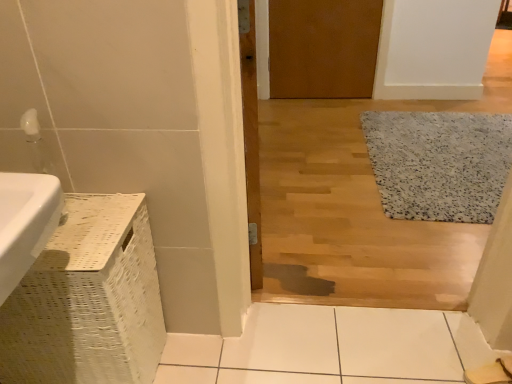
Question: Which direction should I rotate to face brown matte door at upper center, marked as the second door in a left-to-right arrangement, — up or down?

Choices:
 (A) up
 (B) down

Answer: (A)

Question: Does brown matte door at upper center, which ranks as the second door in front-to-back order, come in front of wooden door at center, which is the 1th door in bottom-to-top order?

Choices:
 (A) yes
 (B) no

Answer: (B)

Question: Does brown matte door at upper center, which ranks as the second door in front-to-back order, come behind wooden door at center, acting as the first door starting from the left?

Choices:
 (A) no
 (B) yes

Answer: (B)

Question: Considering the relative positions of brown matte door at upper center, which ranks as the second door in front-to-back order, and wooden door at center, which is the 1th door in bottom-to-top order, in the image provided, is brown matte door at upper center, which ranks as the second door in front-to-back order, to the right of wooden door at center, which is the 1th door in bottom-to-top order, from the viewer's perspective?

Choices:
 (A) no
 (B) yes

Answer: (B)

Question: Would you say brown matte door at upper center, the 1th door positioned from the right, contains wooden door at center, which is the 1th door from front to back?

Choices:
 (A) yes
 (B) no

Answer: (B)

Question: From the image's perspective, is brown matte door at upper center, placed as the 1th door when sorted from top to bottom, over wooden door at center, which is the 1th door from front to back?

Choices:
 (A) yes
 (B) no

Answer: (A)

Question: From a real-world perspective, does brown matte door at upper center, which ranks as the second door in front-to-back order, sit lower than wooden door at center, which is the 1th door from front to back?

Choices:
 (A) no
 (B) yes

Answer: (B)

Question: From a real-world perspective, is wooden door at center, acting as the first door starting from the left, on top of white speckled rug at right?

Choices:
 (A) yes
 (B) no

Answer: (A)

Question: Is wooden door at center, the 2th door viewed from the right, smaller than white speckled rug at right?

Choices:
 (A) no
 (B) yes

Answer: (B)

Question: Does wooden door at center, which is the 2th door in top-to-bottom order, appear on the left side of white speckled rug at right?

Choices:
 (A) no
 (B) yes

Answer: (B)

Question: Is wooden door at center, the 2th door viewed from the right, behind white speckled rug at right?

Choices:
 (A) no
 (B) yes

Answer: (A)

Question: Is wooden door at center, the 2th door viewed from the right, bigger than white speckled rug at right?

Choices:
 (A) yes
 (B) no

Answer: (B)

Question: Is wooden door at center, which is the 2th door in top-to-bottom order, facing away from white speckled rug at right?

Choices:
 (A) yes
 (B) no

Answer: (B)

Question: Can we say white speckled rug at right lies outside wooden door at center, positioned as the 2th door in back-to-front order?

Choices:
 (A) no
 (B) yes

Answer: (B)